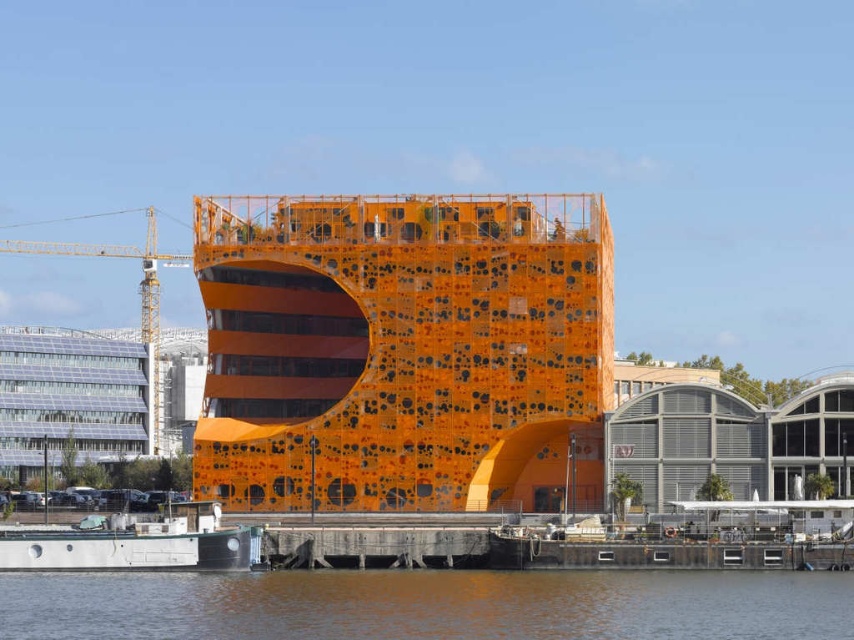
Question: Among these points, which one is nearest to the camera?

Choices:
 (A) (143, 330)
 (B) (293, 550)

Answer: (B)

Question: Which point appears farthest from the camera in this image?

Choices:
 (A) click(x=418, y=540)
 (B) click(x=194, y=545)

Answer: (A)

Question: Is orange matte building at center positioned at the back of smooth orange water at lower center?

Choices:
 (A) yes
 (B) no

Answer: (A)

Question: Which point appears closest to the camera in this image?

Choices:
 (A) (26, 545)
 (B) (488, 545)

Answer: (A)

Question: Is the position of smooth orange water at lower center less distant than that of concrete dock at lower center?

Choices:
 (A) yes
 (B) no

Answer: (A)

Question: Does orange matte building at center have a lesser width compared to metallic gray boat at lower left?

Choices:
 (A) no
 (B) yes

Answer: (A)